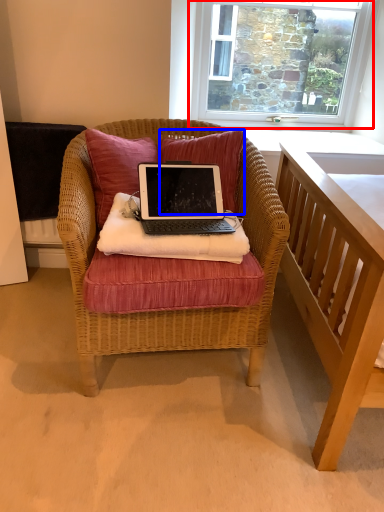
Question: Which of the following is the farthest to the observer, window (highlighted by a red box) or pillow (highlighted by a blue box)?

Choices:
 (A) window
 (B) pillow

Answer: (A)